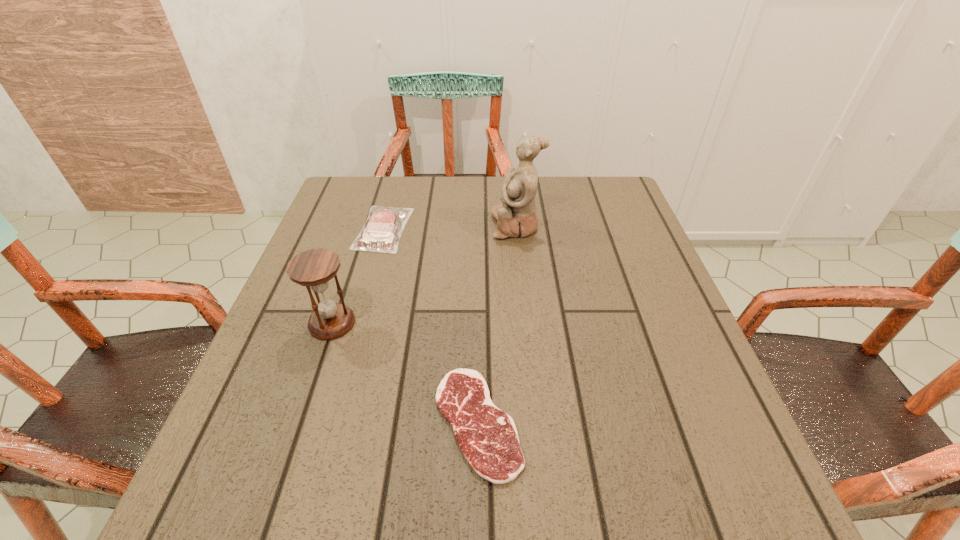
At what (x,y) coordinates should I click in order to perform the action: click on the tallest object. Please return your answer as a coordinate pair (x, y). Image resolution: width=960 pixels, height=540 pixels. Looking at the image, I should click on (516, 216).

In order to click on hourglass in this screenshot , I will do `click(313, 268)`.

At what (x,y) coordinates should I click in order to perform the action: click on the second tallest object. Please return your answer as a coordinate pair (x, y). Looking at the image, I should click on (313, 268).

Where is `the taller steak`? The image size is (960, 540). the taller steak is located at coordinates tap(382, 230).

Identify the location of the farther steak. This screenshot has height=540, width=960. (382, 230).

Find the location of `the shorter steak`. the shorter steak is located at coordinates (x=487, y=436).

You are a GUI agent. You are given a task and a screenshot of the screen. Output one action in this format:
    pyautogui.click(x=<x>, y=<y>)
    Task: Click on the right steak
    The image size is (960, 540).
    Given the screenshot: What is the action you would take?
    pyautogui.click(x=487, y=436)

This screenshot has height=540, width=960. What are the coordinates of `vacant space located 0.290m on the front-facing side of the tallest object` in the screenshot? It's located at (378, 226).

I want to click on free location located 0.320m on the front-facing side of the tallest object, so click(367, 226).

The width and height of the screenshot is (960, 540). What are the coordinates of `vacant region located on the front-facing side of the tallest object` in the screenshot? It's located at (367, 226).